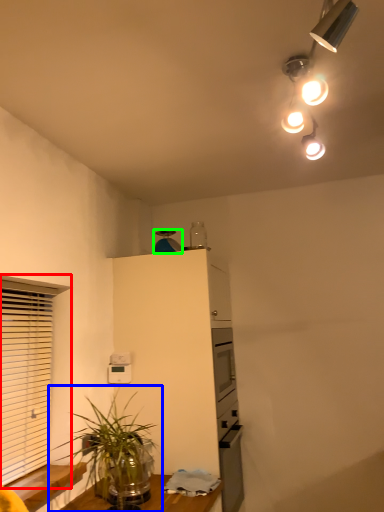
Question: Which is farther away from window (highlighted by a red box)? houseplant (highlighted by a blue box) or appliance (highlighted by a green box)?

Choices:
 (A) houseplant
 (B) appliance

Answer: (B)